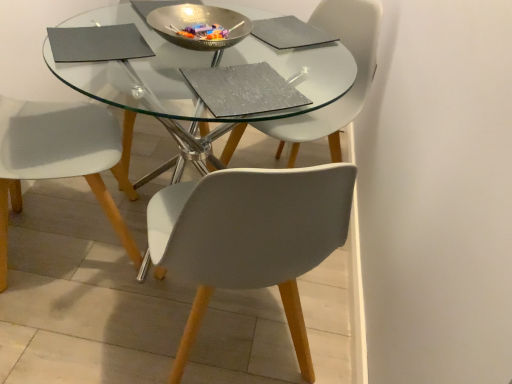
Question: Is matte gray chair at center, acting as the second chair starting from the left, smaller than metallic silver bowl at center?

Choices:
 (A) no
 (B) yes

Answer: (A)

Question: Does matte gray chair at center, the first chair in the right-to-left sequence, have a greater width compared to metallic silver bowl at center?

Choices:
 (A) yes
 (B) no

Answer: (A)

Question: Considering the relative positions of matte gray chair at center, acting as the second chair starting from the left, and metallic silver bowl at center in the image provided, is matte gray chair at center, acting as the second chair starting from the left, to the left of metallic silver bowl at center from the viewer's perspective?

Choices:
 (A) yes
 (B) no

Answer: (B)

Question: Is the position of matte gray chair at center, acting as the second chair starting from the left, more distant than that of metallic silver bowl at center?

Choices:
 (A) no
 (B) yes

Answer: (B)

Question: Is matte gray chair at center, acting as the second chair starting from the left, outside metallic silver bowl at center?

Choices:
 (A) no
 (B) yes

Answer: (B)

Question: Is matte gray chair at center, acting as the second chair starting from the left, oriented towards metallic silver bowl at center?

Choices:
 (A) no
 (B) yes

Answer: (B)

Question: Can you confirm if white matte chair at lower left, which is the second chair in right-to-left order, is smaller than matte gray chair at center, the first chair in the right-to-left sequence?

Choices:
 (A) no
 (B) yes

Answer: (A)

Question: Can you confirm if white matte chair at lower left, which is the second chair in right-to-left order, is positioned to the left of matte gray chair at center, acting as the second chair starting from the left?

Choices:
 (A) no
 (B) yes

Answer: (B)

Question: Is white matte chair at lower left, which is the second chair in right-to-left order, turned away from matte gray chair at center, acting as the second chair starting from the left?

Choices:
 (A) no
 (B) yes

Answer: (A)

Question: From a real-world perspective, does white matte chair at lower left, which is the second chair in right-to-left order, stand above matte gray chair at center, acting as the second chair starting from the left?

Choices:
 (A) yes
 (B) no

Answer: (A)

Question: Considering the relative sizes of white matte chair at lower left, placed as the first chair when sorted from left to right, and matte gray chair at center, the first chair in the right-to-left sequence, in the image provided, is white matte chair at lower left, placed as the first chair when sorted from left to right, wider than matte gray chair at center, the first chair in the right-to-left sequence,?

Choices:
 (A) yes
 (B) no

Answer: (A)

Question: Is white matte chair at lower left, which is the second chair in right-to-left order, behind matte gray chair at center, acting as the second chair starting from the left?

Choices:
 (A) yes
 (B) no

Answer: (B)

Question: Considering the relative sizes of metallic silver bowl at center and white matte chair at lower left, placed as the first chair when sorted from left to right, in the image provided, is metallic silver bowl at center wider than white matte chair at lower left, placed as the first chair when sorted from left to right,?

Choices:
 (A) yes
 (B) no

Answer: (B)